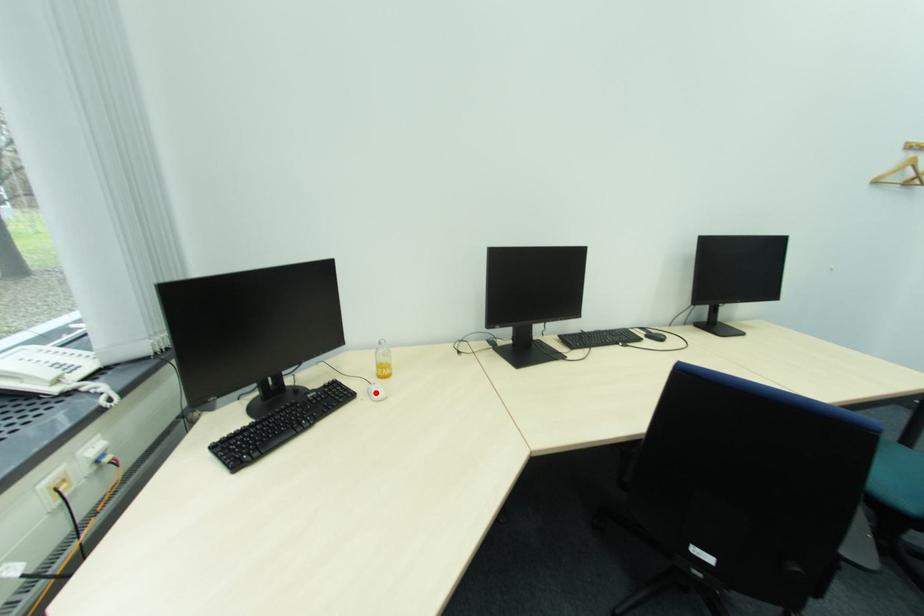
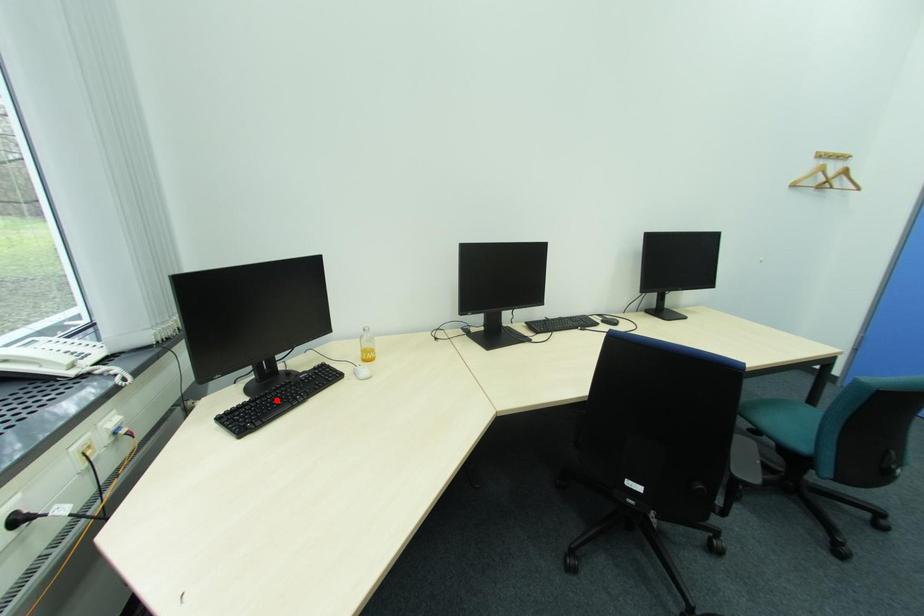
I am providing you with two images of the same scene from different viewpoints. A red point is marked on the first image and another point is marked on the second image. Is the marked point in image1 the same physical position as the marked point in image2?

No